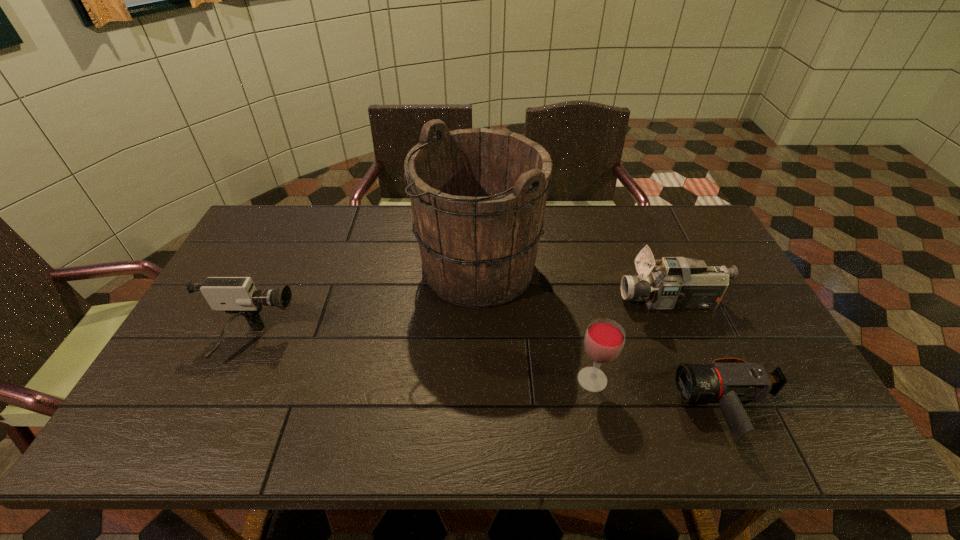
This screenshot has height=540, width=960. Find the location of `free point between the leftmost camcorder and the shortest camcorder`. free point between the leftmost camcorder and the shortest camcorder is located at coordinates (491, 375).

Identify the location of free space between the third object from right to left and the bucket. (536, 324).

You are a GUI agent. You are given a task and a screenshot of the screen. Output one action in this format:
    pyautogui.click(x=<x>, y=<y>)
    Task: Click on the free space between the third object from right to left and the bucket
    The width and height of the screenshot is (960, 540).
    Given the screenshot: What is the action you would take?
    pos(536,324)

Where is `free area in between the leftmost object and the wineglass`? The width and height of the screenshot is (960, 540). free area in between the leftmost object and the wineglass is located at coordinates (421, 361).

What are the coordinates of `free spot between the wineglass and the leftmost object` in the screenshot? It's located at (421, 361).

Choose which object is the fourth nearest neighbor to the third object from right to left. Please provide its 2D coordinates. Your answer should be formatted as a tuple, i.e. [(x, y)], where the tuple contains the x and y coordinates of a point satisfying the conditions above.

[(238, 296)]

Where is `object that stands as the second closest to the shortest object`? The image size is (960, 540). object that stands as the second closest to the shortest object is located at coordinates (679, 283).

Where is `camcorder that is the second closest to the leftmost object`? The width and height of the screenshot is (960, 540). camcorder that is the second closest to the leftmost object is located at coordinates (729, 381).

Locate which camcorder ranks second in proximity to the shortest object. Please provide its 2D coordinates. Your answer should be formatted as a tuple, i.e. [(x, y)], where the tuple contains the x and y coordinates of a point satisfying the conditions above.

[(238, 296)]

The height and width of the screenshot is (540, 960). I want to click on vacant position in the image that satisfies the following two spatial constraints: 1. on the recording direction of the third object from left to right; 2. on the right side of the leftmost object, so click(x=234, y=380).